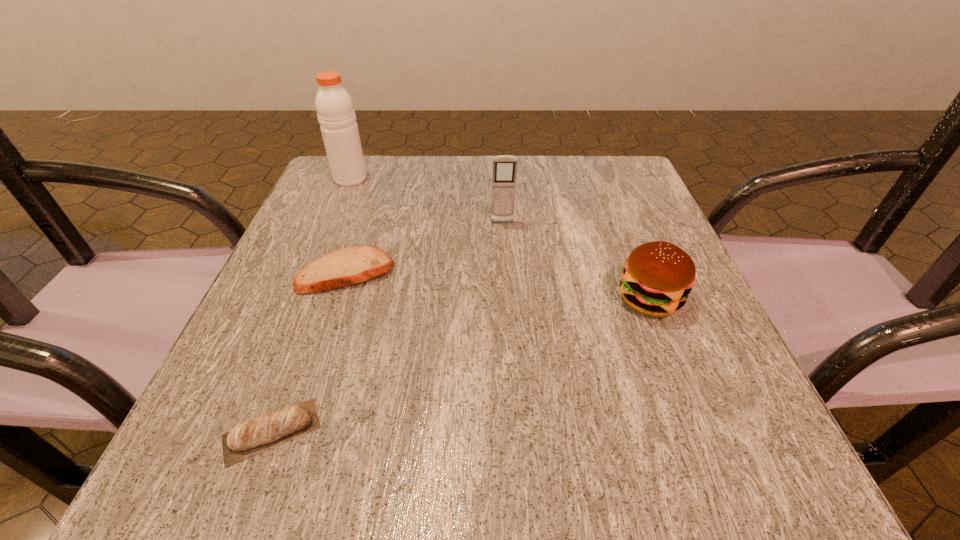
Identify the location of the tallest object. Image resolution: width=960 pixels, height=540 pixels. (335, 110).

Locate an element on the screen. Image resolution: width=960 pixels, height=540 pixels. the farthest object is located at coordinates pyautogui.click(x=335, y=110).

Identify the location of the fourth object from left to right. The image size is (960, 540). (504, 166).

Where is `the second tallest object`? the second tallest object is located at coordinates (504, 166).

Where is `hamburger`? The image size is (960, 540). hamburger is located at coordinates (658, 276).

Locate an element on the screen. The width and height of the screenshot is (960, 540). the rightmost object is located at coordinates (658, 276).

Locate an element on the screen. Image resolution: width=960 pixels, height=540 pixels. the farther pita bread is located at coordinates (349, 266).

Locate an element on the screen. The height and width of the screenshot is (540, 960). the nearer pita bread is located at coordinates (248, 438).

At what (x,y) coordinates should I click in order to perform the action: click on free space located on the front of the farthest object. Please return your answer as a coordinate pair (x, y). Looking at the image, I should click on (301, 295).

Where is `free location located on the front-facing side of the second farthest object`? Image resolution: width=960 pixels, height=540 pixels. free location located on the front-facing side of the second farthest object is located at coordinates (510, 336).